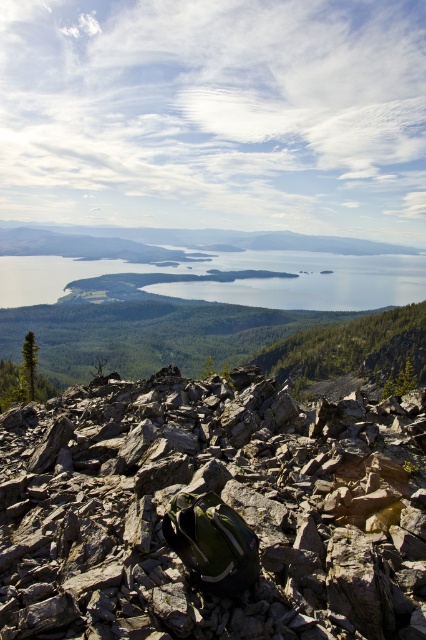
Question: Which object is closer to the camera taking this photo?

Choices:
 (A) gray rocky boulder at center
 (B) green textured hillside at center

Answer: (A)

Question: Does gray rocky boulder at center come behind green textured hillside at center?

Choices:
 (A) yes
 (B) no

Answer: (B)

Question: Which point is closer to the camera taking this photo?

Choices:
 (A) (317, 360)
 (B) (51, 632)

Answer: (B)

Question: Does gray rocky boulder at center appear over green textured hillside at center?

Choices:
 (A) yes
 (B) no

Answer: (B)

Question: Is gray rocky boulder at center positioned at the back of green textured hillside at center?

Choices:
 (A) yes
 (B) no

Answer: (B)

Question: Which point is closer to the camera?

Choices:
 (A) (382, 440)
 (B) (60, 369)

Answer: (A)